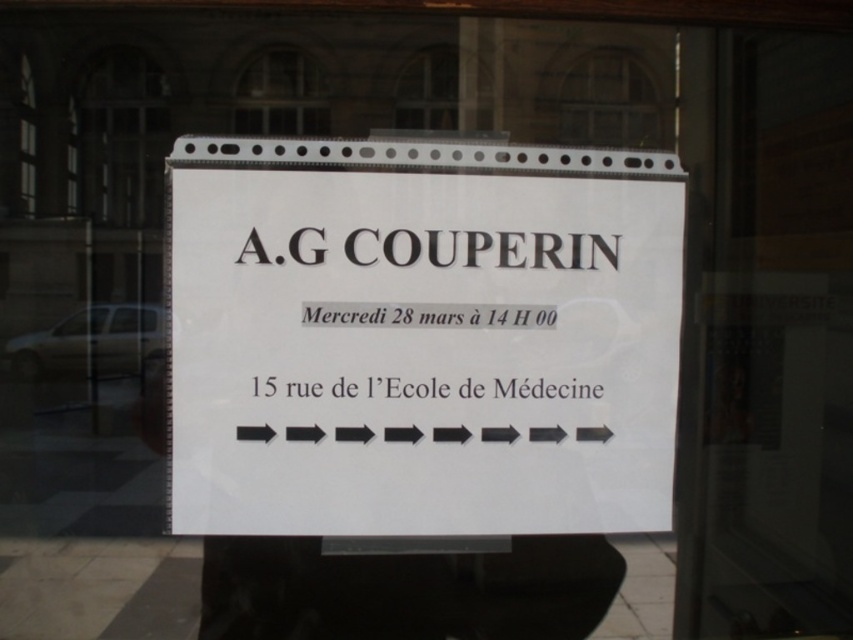
Can you confirm if transparent glass door at center is smaller than clear glass window at upper center?

No.

What do you see at coordinates (764, 337) in the screenshot? I see `transparent glass door at center` at bounding box center [764, 337].

Find the location of a particular element. transparent glass door at center is located at coordinates (764, 337).

Is white paper sign at center thinner than clear glass window at upper center?

No.

Does point (318, 506) come behind point (318, 129)?

Yes, it is behind point (318, 129).

The height and width of the screenshot is (640, 853). Find the location of `white paper sign at center`. white paper sign at center is located at coordinates (421, 337).

Who is lower down, white paper sign at center or transparent glass door at center?

transparent glass door at center

Who is more forward, (492, 502) or (834, 58)?

Positioned in front is point (834, 58).

This screenshot has height=640, width=853. Find the location of `white paper sign at center`. white paper sign at center is located at coordinates (421, 337).